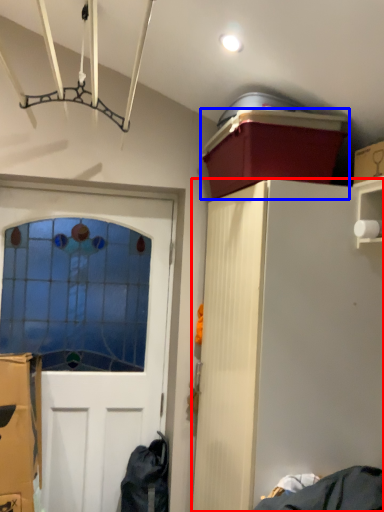
Question: Which object appears closest to the camera in this image, cabinetry (highlighted by a red box) or box (highlighted by a blue box)?

Choices:
 (A) cabinetry
 (B) box

Answer: (A)